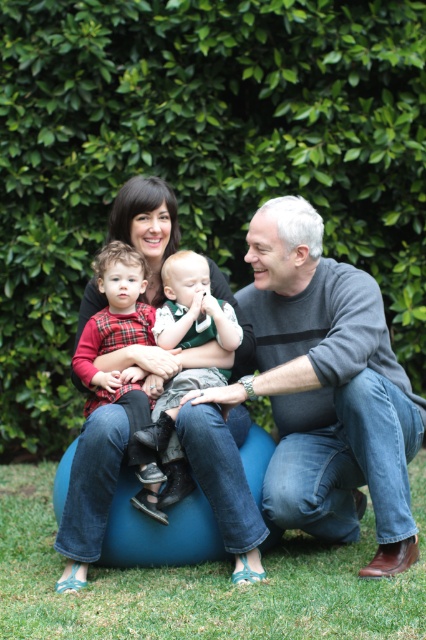
Question: Does green leafy hedge at upper center lie in front of blue fabric bean bag at center?

Choices:
 (A) no
 (B) yes

Answer: (A)

Question: Can you confirm if matte black sweater at center is bigger than plaid fabric baby at center?

Choices:
 (A) yes
 (B) no

Answer: (A)

Question: Which of the following is the farthest from the observer?

Choices:
 (A) blue fabric bean bag at center
 (B) plaid fabric baby at center
 (C) green leafy hedge at upper center
 (D) matte black sweater at center

Answer: (C)

Question: Which point is farther to the camera?

Choices:
 (A) (112, 134)
 (B) (164, 330)
 (C) (339, 412)
 (D) (118, 248)

Answer: (A)

Question: Is green leafy hedge at upper center wider than blue fabric bean bag at center?

Choices:
 (A) no
 (B) yes

Answer: (B)

Question: Estimate the real-world distances between objects in this image. Which object is farther from the green leafy hedge at upper center?

Choices:
 (A) blue fabric bean bag at center
 (B) plaid fabric baby at center
 (C) matte black sweater at center

Answer: (A)